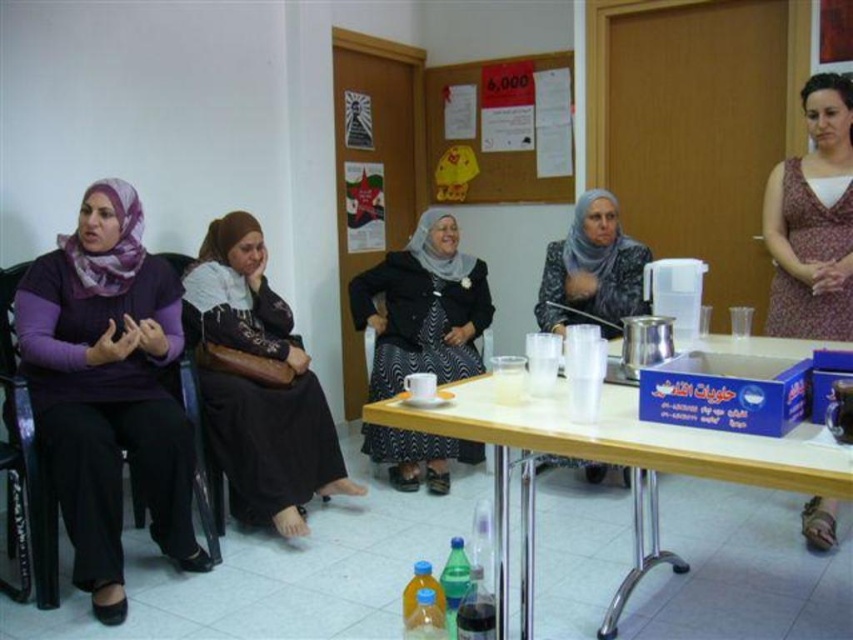
You are a photographer taking a photo of the purple matte hijab at left and the matte black hijab at center. Which hijab should you focus on first to ensure both are in frame without moving the camera?

The purple matte hijab at left is taller than the matte black hijab at center, so focusing on the taller one first will ensure both are in frame without needing to adjust the camera angle.

You are a delivery person who needs to place a small package between the purple matte hijab at left and the matte black hijab at center. The package is 1.5 meters long. Will it fit in the space between them?

The distance between the purple matte hijab at left and the matte black hijab at center is 1.86 meters. Since the package is 1.5 meters long, it will fit in the space between them as there is enough room.

You are a photographer standing at the front of the room. You want to take a photo of the women seated around the table. The camera you are using has a focal length of 50mm. The point at coordinates (x=258, y=384) is located on the black fabric dress at left. Based on the given coordinates, can you estimate whether this point is closer to the camera or farther away compared to the other objects in the scene?

The point at coordinates (x=258, y=384) is on the black fabric dress at left, which is part of the women seated around the table. Since the women are seated at the table in the center of the room and the photographer is at the front, the point on the black fabric dress at left would be closer to the camera than objects farther back, like the doors or the corkboard in the background.